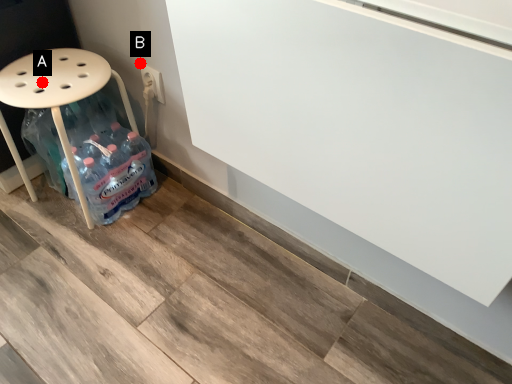
Question: Two points are circled on the image, labeled by A and B beside each circle. Among these points, which one is farthest from the camera?

Choices:
 (A) A is further
 (B) B is further

Answer: (B)